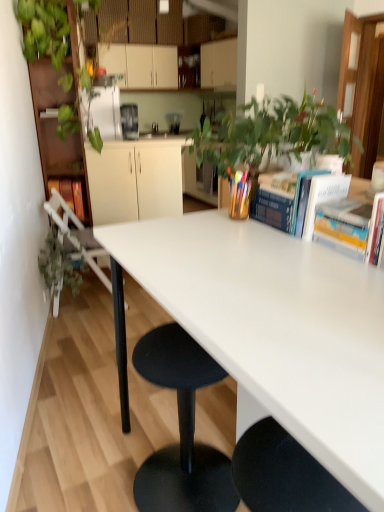
Question: Considering the relative sizes of hardcover book at left, which is counted as the 1th book, starting from the back, and black plastic stool at center in the image provided, is hardcover book at left, which is counted as the 1th book, starting from the back, shorter than black plastic stool at center?

Choices:
 (A) no
 (B) yes

Answer: (B)

Question: Is hardcover book at left, which is the 1th book in left-to-right order, behind black plastic stool at center?

Choices:
 (A) yes
 (B) no

Answer: (A)

Question: Is hardcover book at left, the 5th book from the right, far from black plastic stool at center?

Choices:
 (A) no
 (B) yes

Answer: (B)

Question: From the image's perspective, would you say hardcover book at left, which is counted as the 1th book, starting from the back, is positioned over black plastic stool at center?

Choices:
 (A) no
 (B) yes

Answer: (B)

Question: Is hardcover book at left, which is counted as the 1th book, starting from the back, closer to camera compared to black plastic stool at center?

Choices:
 (A) yes
 (B) no

Answer: (B)

Question: Would you say hardcover book at upper right, acting as the 2th book starting from the back, is to the left or to the right of green leafy plant at left in the picture?

Choices:
 (A) left
 (B) right

Answer: (B)

Question: From a real-world perspective, is hardcover book at upper right, which is the second book in left-to-right order, above or below green leafy plant at left?

Choices:
 (A) above
 (B) below

Answer: (A)

Question: Considering the positions of hardcover book at upper right, acting as the 2th book starting from the back, and green leafy plant at left in the image, is hardcover book at upper right, acting as the 2th book starting from the back, taller or shorter than green leafy plant at left?

Choices:
 (A) tall
 (B) short

Answer: (B)

Question: Considering the positions of hardcover book at upper right, which is the second book in left-to-right order, and green leafy plant at left in the image, is hardcover book at upper right, which is the second book in left-to-right order, bigger or smaller than green leafy plant at left?

Choices:
 (A) big
 (B) small

Answer: (B)

Question: Considering the positions of white plastic chair at left and white matte cabinet at center, the second cabinetry from the back, in the image, is white plastic chair at left taller or shorter than white matte cabinet at center, the second cabinetry from the back,?

Choices:
 (A) short
 (B) tall

Answer: (A)

Question: Considering the positions of white plastic chair at left and white matte cabinet at center, the second cabinetry from the back, in the image, is white plastic chair at left wider or thinner than white matte cabinet at center, the second cabinetry from the back,?

Choices:
 (A) wide
 (B) thin

Answer: (A)

Question: From the image's perspective, is white plastic chair at left above or below white matte cabinet at center, placed as the first cabinetry when sorted from front to back?

Choices:
 (A) below
 (B) above

Answer: (A)

Question: Is white plastic chair at left to the left or to the right of white matte cabinet at center, the second cabinetry when ordered from top to bottom, in the image?

Choices:
 (A) right
 (B) left

Answer: (B)

Question: Considering the positions of point (178, 114) and point (374, 468), is point (178, 114) closer or farther from the camera than point (374, 468)?

Choices:
 (A) closer
 (B) farther

Answer: (B)

Question: Is metallic silver toaster at center, the second appliance positioned from the left, wider or thinner than white glossy table at center?

Choices:
 (A) thin
 (B) wide

Answer: (A)